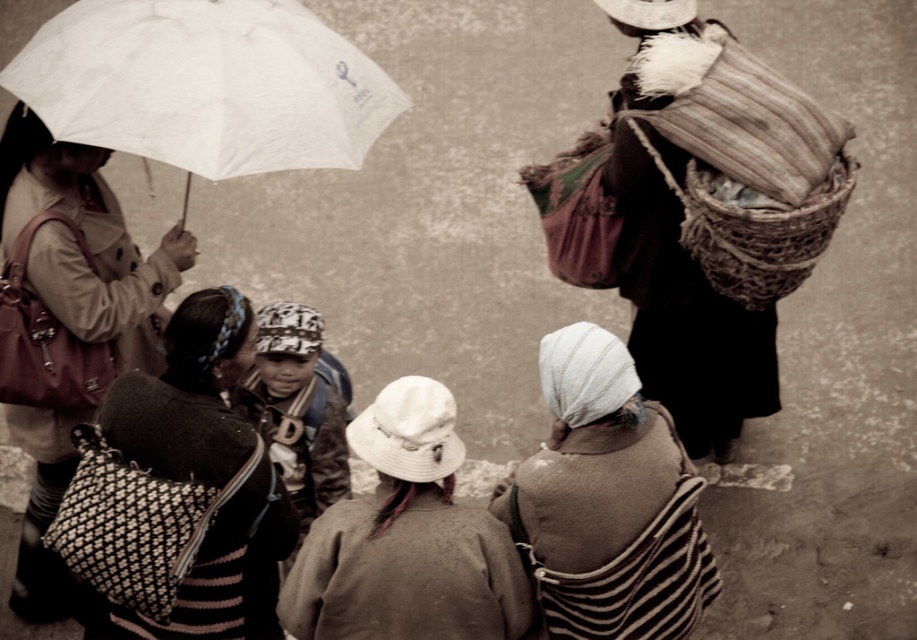
Is white matte umbrella at upper left above knitted woolen bag at lower left?

Yes.

Measure the distance between white matte umbrella at upper left and camera.

The distance of white matte umbrella at upper left from camera is 5.67 meters.

Identify the location of white matte umbrella at upper left. (205, 84).

Between white matte umbrella at upper left and patterned fabric bag at left, which one is positioned higher?

white matte umbrella at upper left is above.

Is point (288, 4) less distant than point (42, 164)?

No, it is not.

Is point (255, 3) positioned behind point (65, 605)?

No, (255, 3) is closer to viewer.

Image resolution: width=917 pixels, height=640 pixels. Find the location of `white matte umbrella at upper left`. white matte umbrella at upper left is located at coordinates (205, 84).

Which is more to the right, white matte umbrella at upper left or white striped shawl at center?

white striped shawl at center

Is white matte umbrella at upper left shorter than white striped shawl at center?

Correct, white matte umbrella at upper left is not as tall as white striped shawl at center.

The height and width of the screenshot is (640, 917). Identify the location of white matte umbrella at upper left. (205, 84).